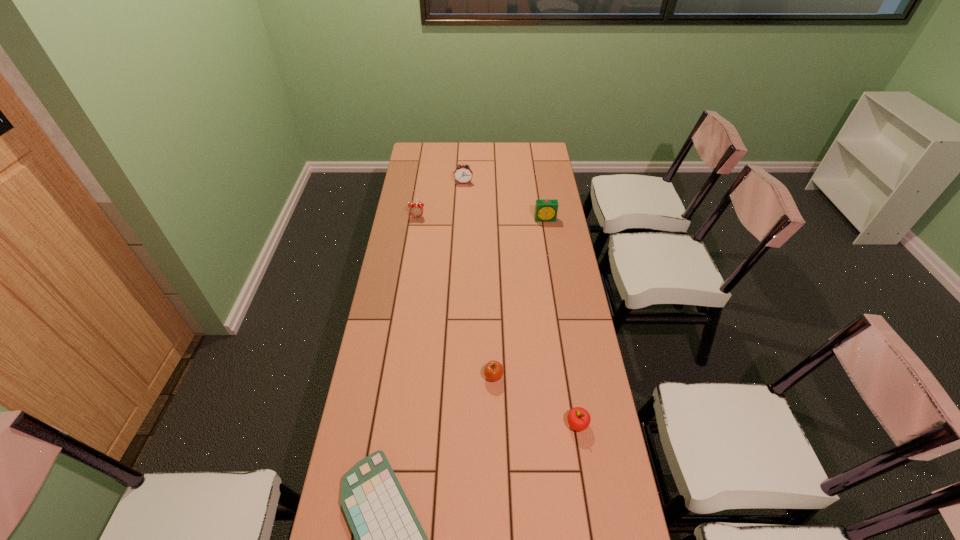
The height and width of the screenshot is (540, 960). What are the coordinates of `the farthest alarm clock` in the screenshot? It's located at (463, 174).

Identify the location of the farthest object. (463, 174).

Find the location of a particular element. the rightmost alarm clock is located at coordinates (546, 210).

This screenshot has width=960, height=540. Find the location of `the leftmost alarm clock`. the leftmost alarm clock is located at coordinates coord(416,210).

Where is `the fourth object from left to right`? the fourth object from left to right is located at coordinates (493, 371).

Image resolution: width=960 pixels, height=540 pixels. Find the location of `the left apple`. the left apple is located at coordinates (493, 371).

Identify the location of the nearer apple. (578, 418).

Identify the location of the fifth farthest object. Image resolution: width=960 pixels, height=540 pixels. (578, 418).

In order to click on vacant point located 0.260m on the clock face of the farthest alarm clock in this screenshot , I will do `click(462, 217)`.

Locate an element on the screen. The width and height of the screenshot is (960, 540). free space located on the front-facing side of the rightmost alarm clock is located at coordinates (555, 275).